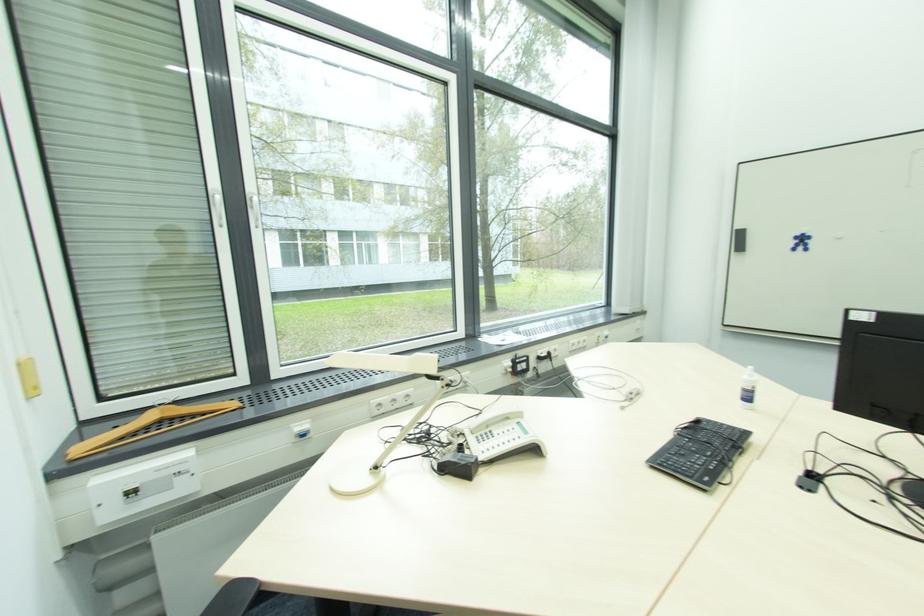
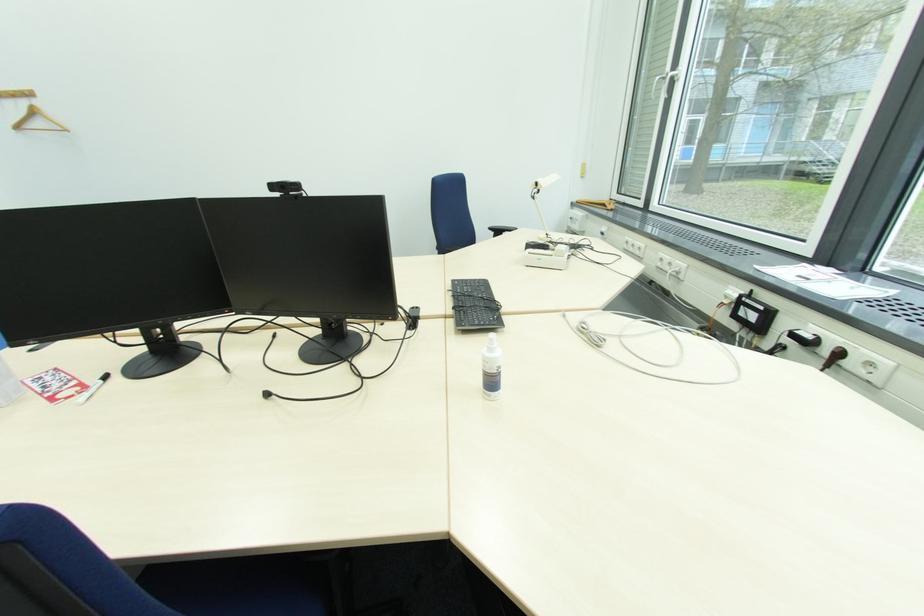
In the second image, find the point that corresponds to (x=710, y=480) in the first image.

(459, 285)